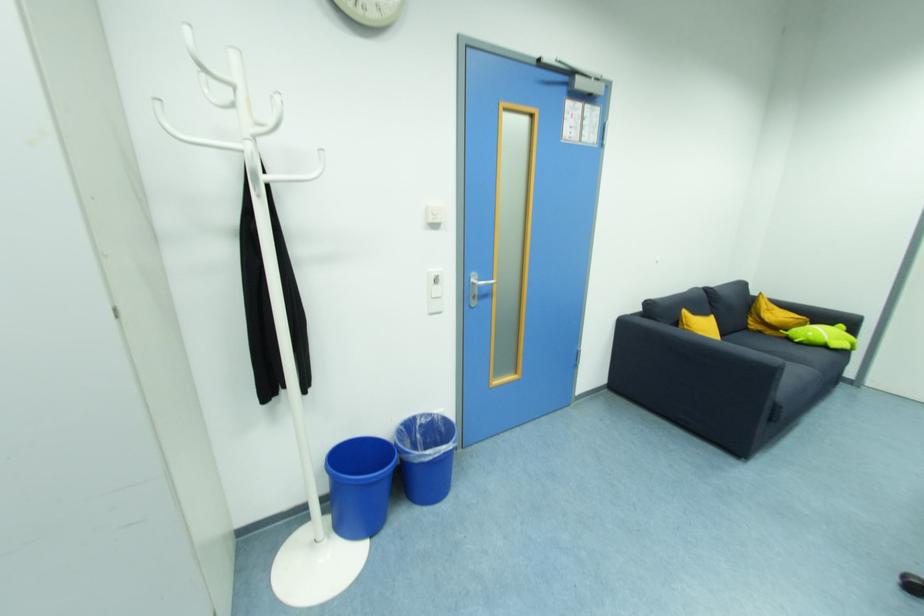
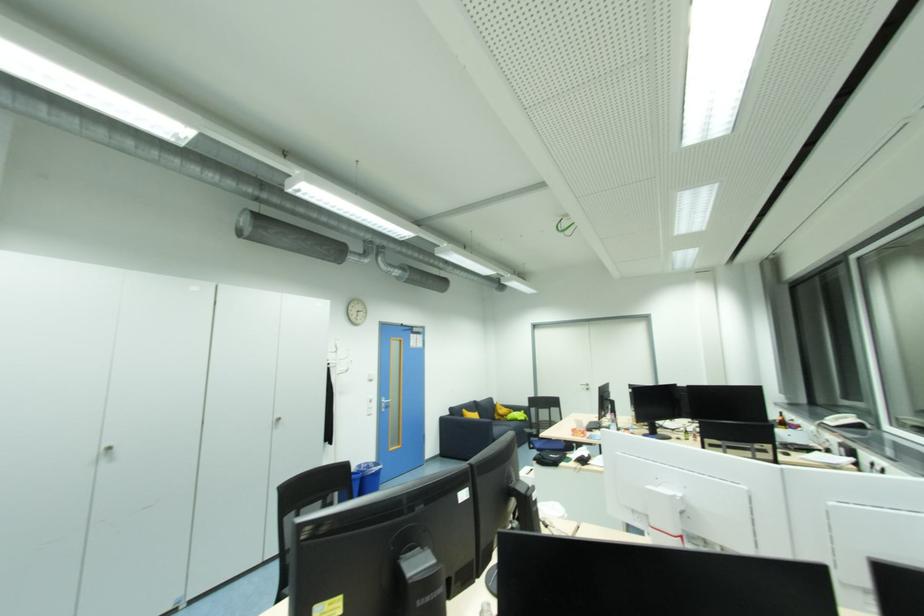
Find the pixel in the second image that matches the point at 844,328 in the first image.

(526, 413)